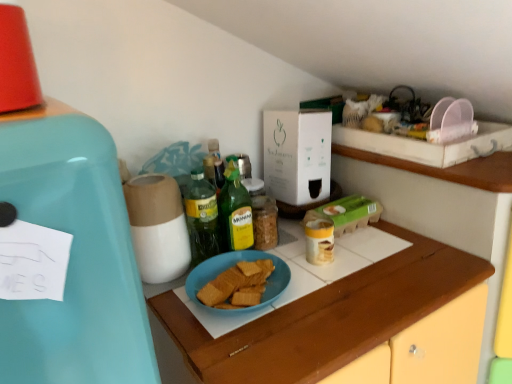
I want to click on vacant area that is situated to the right of green glass bottle at center, which is the 1th bottle from right to left, so click(310, 262).